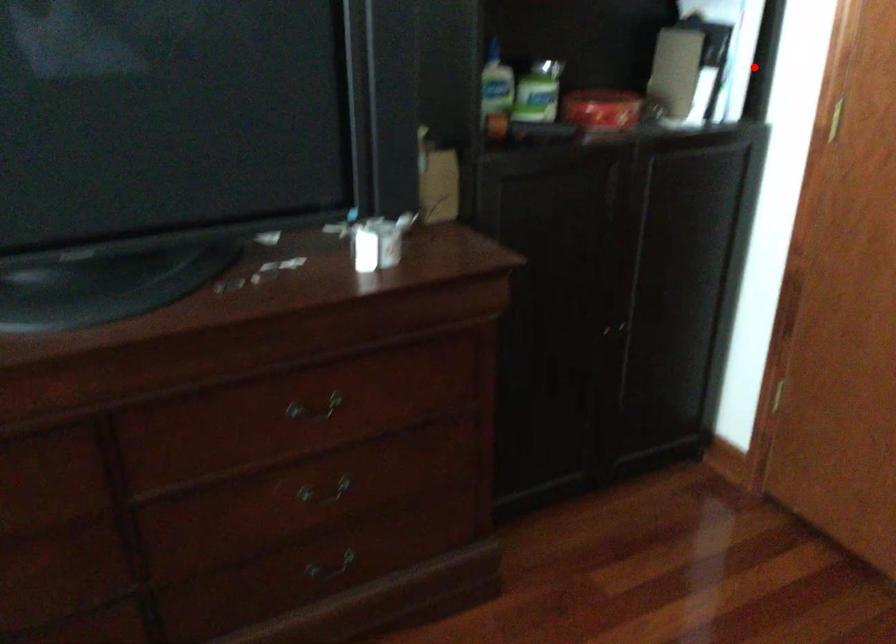
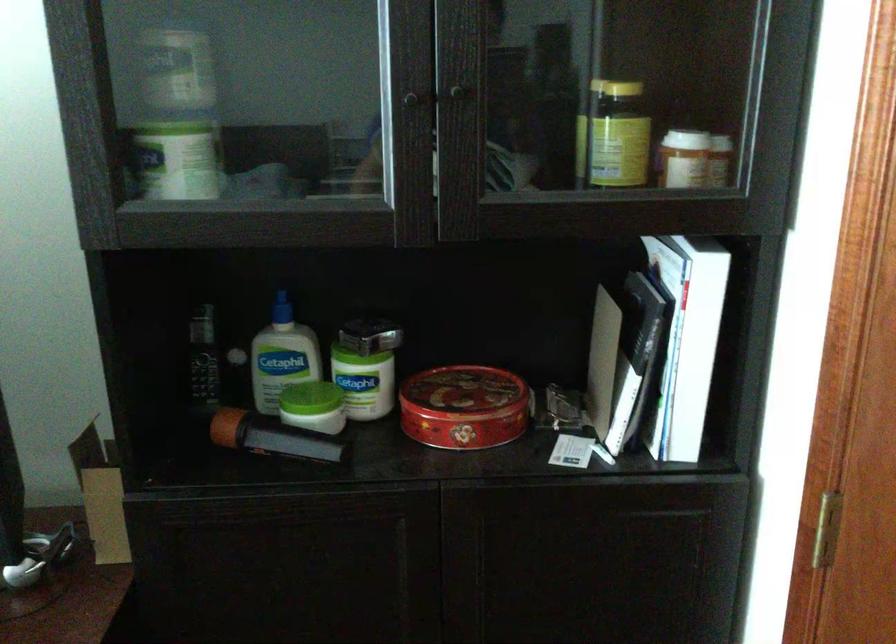
Question: I am providing you with two images of the same scene from different viewpoints. In image1, a red point is highlighted. Considering the same 3D point in image2, which of the following is correct?

Choices:
 (A) It is closer
 (B) It is farther

Answer: (A)